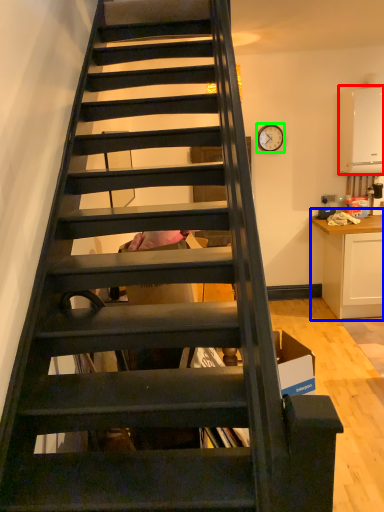
Question: Which object is the farthest from appliance (highlighted by a red box)? Choose among these: cabinetry (highlighted by a blue box) or clock (highlighted by a green box).

Choices:
 (A) cabinetry
 (B) clock

Answer: (A)